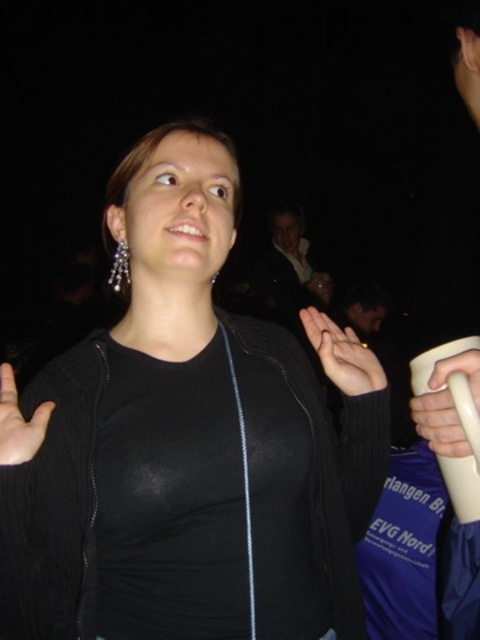
Based on the photo, you are a photographer trying to capture the main subject wearing a black zip up jacket at center. You notice a bright light at point (187, 445). Where is the bright light located in relation to the black zip up jacket at center?

The bright light at point (187, 445) is located on the black matte jacket at center.

You are a photographer adjusting your camera settings in the dark. You notice the matte black hand at center and the smooth skin palm at lower left in your frame. To ensure both are in focus, what should you consider about their distance?

The matte black hand at center is 15.54 inches away from the smooth skin palm at lower left. Since they are separated by this distance, adjusting the focus to account for their spacing will help both be in focus.

You are a photographer adjusting lighting for a night portrait. You notice the matte black hand at center and the smooth skin palm at lower left in your frame. Which object should you focus on to ensure proper exposure since it requires more light due to its size?

The matte black hand at center requires more light because it has a larger size compared to the smooth skin palm at lower left, so focusing on it will help achieve proper exposure.